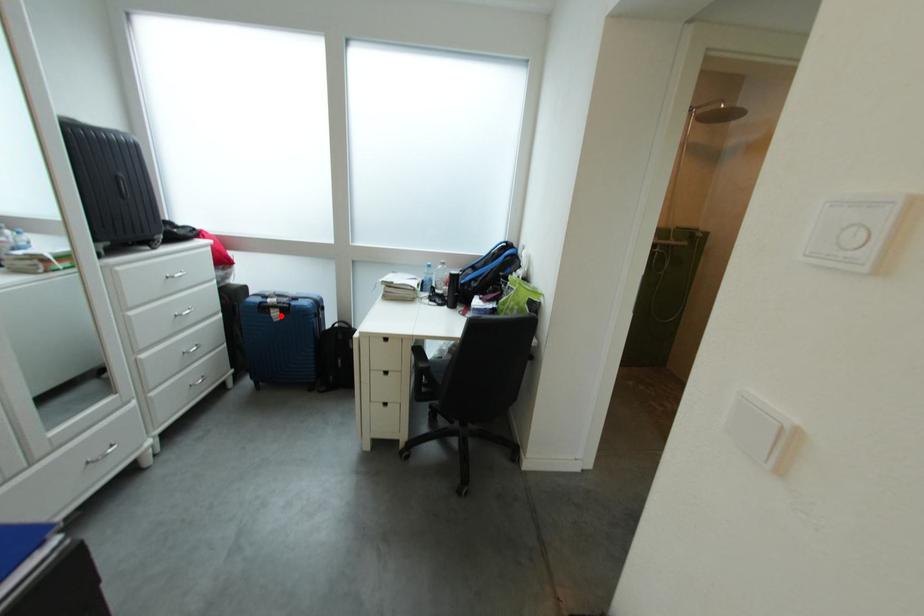
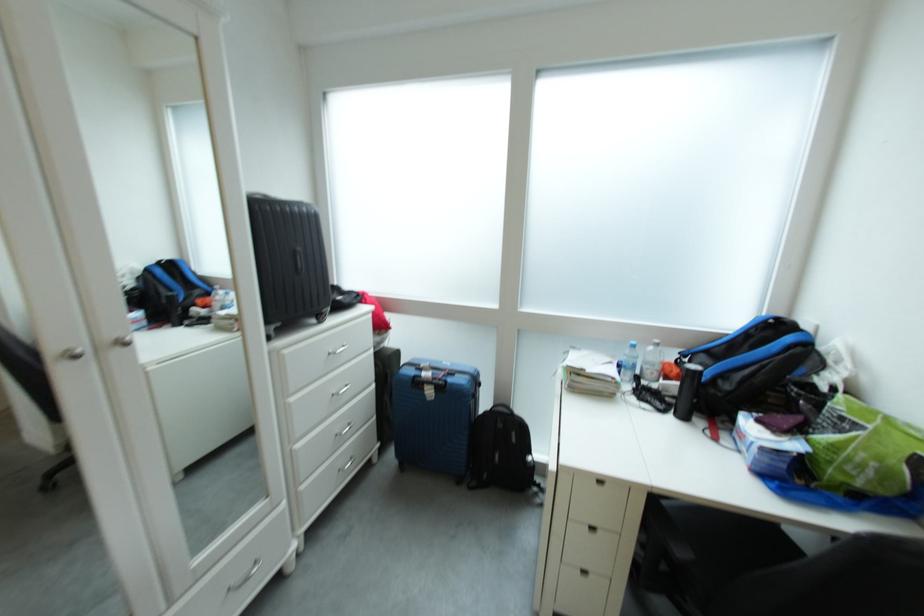
Find the pixel in the second image that matches the highlighted location in the first image.

(434, 392)